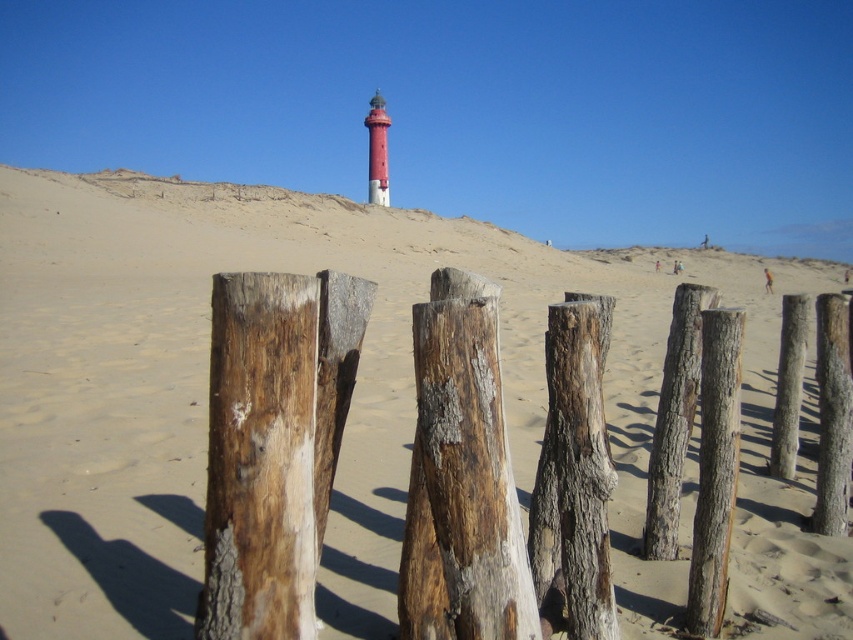
Question: Among these objects, which one is nearest to the camera?

Choices:
 (A) weathered wood post at center
 (B) weathered wood post at center-right
 (C) sandydrysand at center

Answer: (A)

Question: Can you confirm if weathered wood post at center-right is positioned below smooth wood post at upper center?

Choices:
 (A) yes
 (B) no

Answer: (A)

Question: Based on their relative distances, which object is farther from the smooth wood post at upper center?

Choices:
 (A) sandydrysand at center
 (B) weathered wood post at center-right
 (C) weathered wood post at center

Answer: (C)

Question: Does weathered wood post at center-right have a smaller size compared to smooth wood post at upper center?

Choices:
 (A) yes
 (B) no

Answer: (A)

Question: Does weathered wood post at center-right have a greater width compared to smooth wood post at upper center?

Choices:
 (A) yes
 (B) no

Answer: (B)

Question: Which point is farther to the camera?

Choices:
 (A) weathered wood post at center
 (B) smooth wood post at upper center

Answer: (B)